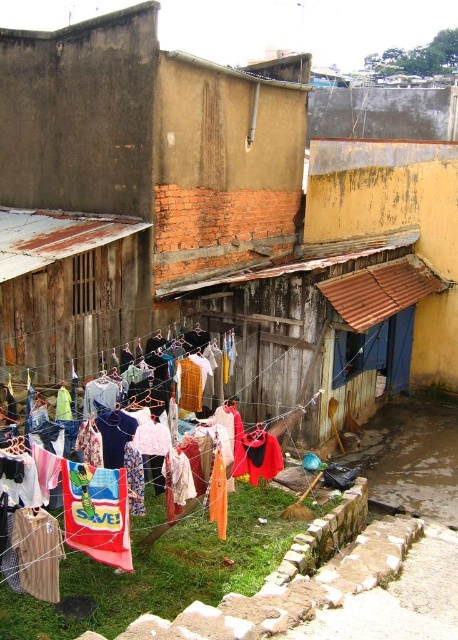
Can you confirm if red fabric banner at center is positioned above red fabric towel at center?

Indeed, red fabric banner at center is positioned over red fabric towel at center.

Who is more distant from viewer, (x=64, y=493) or (x=39, y=545)?

The point (x=64, y=493) is more distant.

At what (x,y) coordinates should I click in order to perform the action: click on red fabric banner at center. Please return your answer as a coordinate pair (x, y). Looking at the image, I should click on (97, 513).

Between red fabric banner at center and red fabric cloth at center, which one appears on the right side from the viewer's perspective?

From the viewer's perspective, red fabric cloth at center appears more on the right side.

Is red fabric banner at center above red fabric cloth at center?

Actually, red fabric banner at center is below red fabric cloth at center.

Find the location of a particular element. The width and height of the screenshot is (458, 640). red fabric banner at center is located at coordinates (97, 513).

The width and height of the screenshot is (458, 640). I want to click on red fabric banner at center, so click(97, 513).

Does multicolored fabric at center appear on the left side of red fabric cloth at center?

A: Indeed, multicolored fabric at center is positioned on the left side of red fabric cloth at center.

Is multicolored fabric at center below red fabric cloth at center?

Yes.

At what (x,y) coordinates should I click in order to perform the action: click on multicolored fabric at center. Please return your answer as a coordinate pair (x, y). The image size is (458, 640). Looking at the image, I should click on (189, 556).